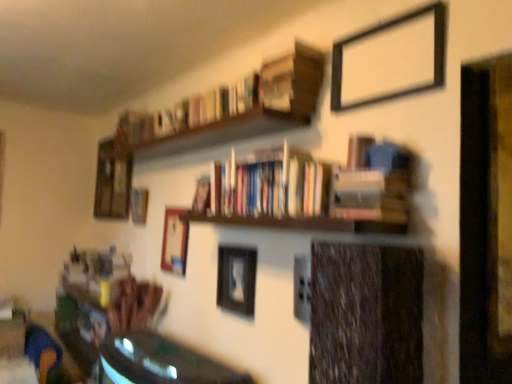
This screenshot has width=512, height=384. I want to click on hardcover book at center, which is counted as the third book, starting from the top, so click(202, 195).

What do you see at coordinates (112, 182) in the screenshot? The height and width of the screenshot is (384, 512). I see `wooden picture frame at upper left, the sixth picture frame from the front` at bounding box center [112, 182].

Where is `wooden picture frame at upper left, positioned as the 5th picture frame in front-to-back order`? wooden picture frame at upper left, positioned as the 5th picture frame in front-to-back order is located at coordinates (139, 204).

You are a GUI agent. You are given a task and a screenshot of the screen. Output one action in this format:
    pyautogui.click(x=<x>, y=<y>)
    Task: Click on the hardcover books at upper center, which is counted as the first book, starting from the top
    
    Given the screenshot: What is the action you would take?
    click(208, 106)

Describe the element at coordinates (174, 242) in the screenshot. The image size is (512, 384). I see `wooden picture frame at center, the 4th picture frame positioned from the right` at that location.

Locate an element on the screen. This screenshot has width=512, height=384. hardcover book at center, which is counted as the third book, starting from the top is located at coordinates (202, 195).

Does point (151, 382) lie in front of point (206, 117)?

Yes.

From a real-world perspective, between shiny green table at lower left and hardcover books at upper center, arranged as the 3th book when ordered from the bottom, who is vertically higher?

hardcover books at upper center, arranged as the 3th book when ordered from the bottom, is physically above.

Consider the image. In terms of size, does shiny green table at lower left appear bigger or smaller than hardcover books at upper center, arranged as the 3th book when ordered from the bottom?

Clearly, shiny green table at lower left is larger in size than hardcover books at upper center, arranged as the 3th book when ordered from the bottom.

Does shiny green table at lower left have a lesser width compared to hardcover books at upper center, which is counted as the first book, starting from the top?

Incorrect, the width of shiny green table at lower left is not less than that of hardcover books at upper center, which is counted as the first book, starting from the top.

Is hardcover books at upper center, which is counted as the first book, starting from the top, positioned far away from black matte picture frame at upper right, which is the second picture frame in front-to-back order?

No, there isn't a large distance between hardcover books at upper center, which is counted as the first book, starting from the top, and black matte picture frame at upper right, which is the second picture frame in front-to-back order.

Can you confirm if hardcover books at upper center, which is counted as the first book, starting from the top, is positioned to the right of black matte picture frame at upper right, the 5th picture frame viewed from the back?

No.

Is hardcover books at upper center, arranged as the 3th book when ordered from the bottom, positioned with its back to black matte picture frame at upper right, the 5th picture frame positioned from the left?

No, black matte picture frame at upper right, the 5th picture frame positioned from the left, is not at the back of hardcover books at upper center, arranged as the 3th book when ordered from the bottom.

From the image's perspective, which is above, hardcover books at upper center, arranged as the 3th book when ordered from the bottom, or black matte picture frame at upper right, the 5th picture frame viewed from the back?

black matte picture frame at upper right, the 5th picture frame viewed from the back, is shown above in the image.

Does point (225, 307) appear closer or farther from the camera than point (395, 204)?

Point (225, 307) is positioned farther from the camera compared to point (395, 204).

Does matte black picture frame at center, the third picture frame positioned from the front, have a lesser width compared to hardcover books at center, marked as the 2th book in a bottom-to-top arrangement?

Yes, matte black picture frame at center, the third picture frame positioned from the front, is thinner than hardcover books at center, marked as the 2th book in a bottom-to-top arrangement.

Is matte black picture frame at center, positioned as the fourth picture frame in left-to-right order, far away from hardcover books at center, marked as the 2th book in a bottom-to-top arrangement?

No, matte black picture frame at center, positioned as the fourth picture frame in left-to-right order, is not far away from hardcover books at center, marked as the 2th book in a bottom-to-top arrangement.

Does hardcover books at upper center, arranged as the 3th book when ordered from the bottom, have a smaller size compared to wooden picture frame at center, placed as the 4th picture frame when sorted from front to back?

Incorrect, hardcover books at upper center, arranged as the 3th book when ordered from the bottom, is not smaller in size than wooden picture frame at center, placed as the 4th picture frame when sorted from front to back.

Which object is positioned more to the right, hardcover books at upper center, arranged as the 3th book when ordered from the bottom, or wooden picture frame at center, placed as the 4th picture frame when sorted from front to back?

hardcover books at upper center, arranged as the 3th book when ordered from the bottom, is more to the right.

Between hardcover books at upper center, arranged as the 3th book when ordered from the bottom, and wooden picture frame at center, the 4th picture frame positioned from the right, which one has less height?

hardcover books at upper center, arranged as the 3th book when ordered from the bottom, is shorter.

Is point (206, 94) farther from viewer compared to point (167, 271)?

No, (206, 94) is closer to viewer.

Consider the image. Is hardcover books at center, which appears as the second book when viewed from the top, looking in the opposite direction of wooden picture frame at upper left, the sixth picture frame from the front?

No, hardcover books at center, which appears as the second book when viewed from the top, is not facing the opposite direction of wooden picture frame at upper left, the sixth picture frame from the front.

Which of these two, hardcover books at center, which appears as the second book when viewed from the top, or wooden picture frame at upper left, marked as the sixth picture frame in a right-to-left arrangement, is bigger?

hardcover books at center, which appears as the second book when viewed from the top, is bigger.

Can you confirm if hardcover books at center, which appears as the second book when viewed from the top, is positioned to the right of wooden picture frame at upper left, the 1th picture frame positioned from the left?

Correct, you'll find hardcover books at center, which appears as the second book when viewed from the top, to the right of wooden picture frame at upper left, the 1th picture frame positioned from the left.

From a real-world perspective, is hardcover books at center, which appears as the second book when viewed from the top, on wooden picture frame at upper left, the sixth picture frame from the front?

No, from a real-world perspective, hardcover books at center, which appears as the second book when viewed from the top, is not on top of wooden picture frame at upper left, the sixth picture frame from the front.

From a real-world perspective, who is located higher, black matte picture frame at upper right, the 5th picture frame positioned from the left, or hardcover books at center, marked as the 2th book in a bottom-to-top arrangement?

black matte picture frame at upper right, the 5th picture frame positioned from the left, is physically above.

From the image's perspective, between black matte picture frame at upper right, the 5th picture frame positioned from the left, and hardcover books at center, which appears as the second book when viewed from the top, who is located below?

hardcover books at center, which appears as the second book when viewed from the top.

Which of these two, black matte picture frame at upper right, the 5th picture frame positioned from the left, or hardcover books at center, marked as the 2th book in a bottom-to-top arrangement, stands shorter?

hardcover books at center, marked as the 2th book in a bottom-to-top arrangement.

Identify the location of the 1st book to the left of the black matte picture frame at upper right, which is the second picture frame in front-to-back order, counting from the anchor's position. The image size is (512, 384). (310, 198).

Considering the positions of objects hardcover book at center, the 1th book ordered from the bottom, and matte black picture frame at center, acting as the fourth picture frame starting from the back, in the image provided, who is more to the right, hardcover book at center, the 1th book ordered from the bottom, or matte black picture frame at center, acting as the fourth picture frame starting from the back,?

matte black picture frame at center, acting as the fourth picture frame starting from the back, is more to the right.

From the image's perspective, is hardcover book at center, which is counted as the third book, starting from the top, located beneath matte black picture frame at center, positioned as the fourth picture frame in left-to-right order?

No, from the image's perspective, hardcover book at center, which is counted as the third book, starting from the top, is not beneath matte black picture frame at center, positioned as the fourth picture frame in left-to-right order.

Is point (196, 185) positioned after point (244, 282)?

Yes.

You are a GUI agent. You are given a task and a screenshot of the screen. Output one action in this format:
    pyautogui.click(x=<x>, y=<y>)
    Task: Click on the table on the left of hardcover books at upper center, arranged as the 3th book when ordered from the bottom
    
    Given the screenshot: What is the action you would take?
    pyautogui.click(x=160, y=362)

There is a hardcover books at upper center, arranged as the 3th book when ordered from the bottom. At what (x,y) coordinates should I click in order to perform the action: click on the 1st picture frame below it (from a real-world perspective). Please return your answer as a coordinate pair (x, y). This screenshot has height=384, width=512. Looking at the image, I should click on (383, 30).

Which object lies further to the anchor point hardcover book at center, which is counted as the third book, starting from the top, wooden picture frame at right, positioned as the sixth picture frame in left-to-right order, or matte black picture frame at center, placed as the third picture frame when sorted from right to left?

wooden picture frame at right, positioned as the sixth picture frame in left-to-right order, lies further to hardcover book at center, which is counted as the third book, starting from the top, than the other object.

Consider the image. Based on their spatial positions, is wooden picture frame at right, positioned as the sixth picture frame in left-to-right order, or wooden picture frame at upper left, positioned as the 5th picture frame in front-to-back order, further from black matte picture frame at upper right, the 5th picture frame viewed from the back?

Among the two, wooden picture frame at upper left, positioned as the 5th picture frame in front-to-back order, is located further to black matte picture frame at upper right, the 5th picture frame viewed from the back.

Considering their positions, is hardcover books at upper center, arranged as the 3th book when ordered from the bottom, positioned further to wooden picture frame at upper left, which appears as the second picture frame when viewed from the left, than wooden picture frame at right, acting as the 1th picture frame starting from the front?

Based on the image, wooden picture frame at right, acting as the 1th picture frame starting from the front, appears to be further to wooden picture frame at upper left, which appears as the second picture frame when viewed from the left.

Which object lies nearer to the anchor point wooden picture frame at right, positioned as the sixth picture frame in left-to-right order, hardcover books at upper center, arranged as the 3th book when ordered from the bottom, or wooden picture frame at center, placed as the 4th picture frame when sorted from front to back?

Based on the image, hardcover books at upper center, arranged as the 3th book when ordered from the bottom, appears to be nearer to wooden picture frame at right, positioned as the sixth picture frame in left-to-right order.

Considering their positions, is wooden picture frame at upper left, marked as the sixth picture frame in a right-to-left arrangement, positioned closer to shiny green table at lower left than wooden picture frame at right, arranged as the 1th picture frame when viewed from the right?

Among the two, wooden picture frame at right, arranged as the 1th picture frame when viewed from the right, is located nearer to shiny green table at lower left.

Looking at the image, which one is located closer to matte black picture frame at center, the third picture frame positioned from the front, wooden picture frame at upper left, marked as the sixth picture frame in a right-to-left arrangement, or wooden picture frame at right, placed as the 6th picture frame when sorted from back to front?

wooden picture frame at right, placed as the 6th picture frame when sorted from back to front, is positioned closer to the anchor matte black picture frame at center, the third picture frame positioned from the front.

Looking at the image, which one is located closer to wooden picture frame at right, placed as the 6th picture frame when sorted from back to front, wooden picture frame at upper left, placed as the 2th picture frame when sorted from back to front, or black matte picture frame at upper right, which is the second picture frame in front-to-back order?

black matte picture frame at upper right, which is the second picture frame in front-to-back order, lies closer to wooden picture frame at right, placed as the 6th picture frame when sorted from back to front, than the other object.

Which object lies further to the anchor point wooden picture frame at center, the third picture frame from the back, matte black picture frame at center, positioned as the fourth picture frame in left-to-right order, or hardcover books at upper center, which is counted as the first book, starting from the top?

hardcover books at upper center, which is counted as the first book, starting from the top, is further to wooden picture frame at center, the third picture frame from the back.

This screenshot has width=512, height=384. What are the coordinates of `table between black matte picture frame at upper right, the 5th picture frame viewed from the back, and wooden picture frame at upper left, which appears as the second picture frame when viewed from the left, from front to back` in the screenshot? It's located at [x=160, y=362].

Locate an element on the screen. The width and height of the screenshot is (512, 384). book between hardcover books at center, marked as the 2th book in a bottom-to-top arrangement, and shiny green table at lower left, in the vertical direction is located at coordinates (202, 195).

Image resolution: width=512 pixels, height=384 pixels. In order to click on book positioned between matte black picture frame at center, placed as the third picture frame when sorted from right to left, and wooden picture frame at upper left, which appears as the second picture frame when viewed from the left, from near to far in this screenshot , I will do `click(202, 195)`.

Find the location of a particular element. table between wooden picture frame at right, arranged as the 1th picture frame when viewed from the right, and wooden picture frame at upper left, the sixth picture frame from the front, from front to back is located at coordinates (160, 362).